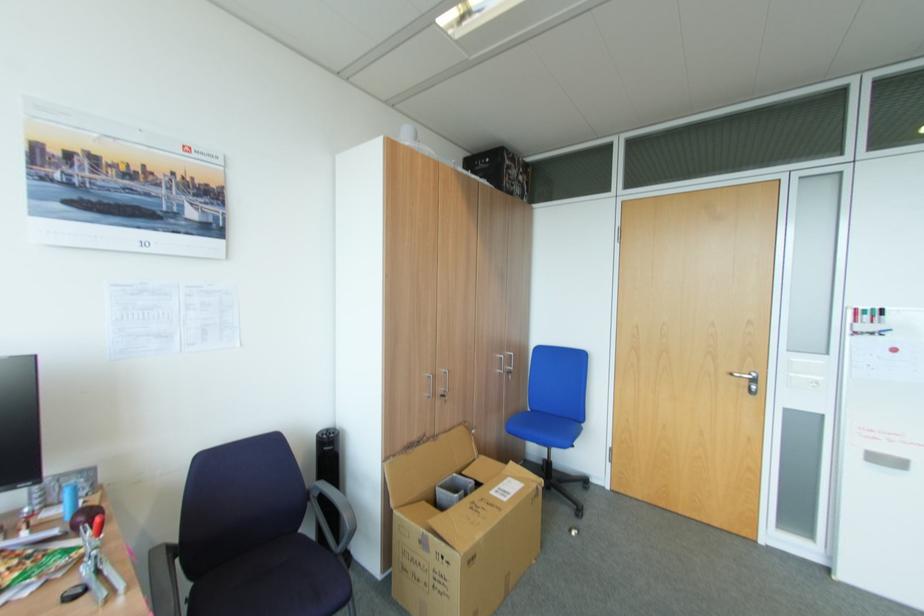
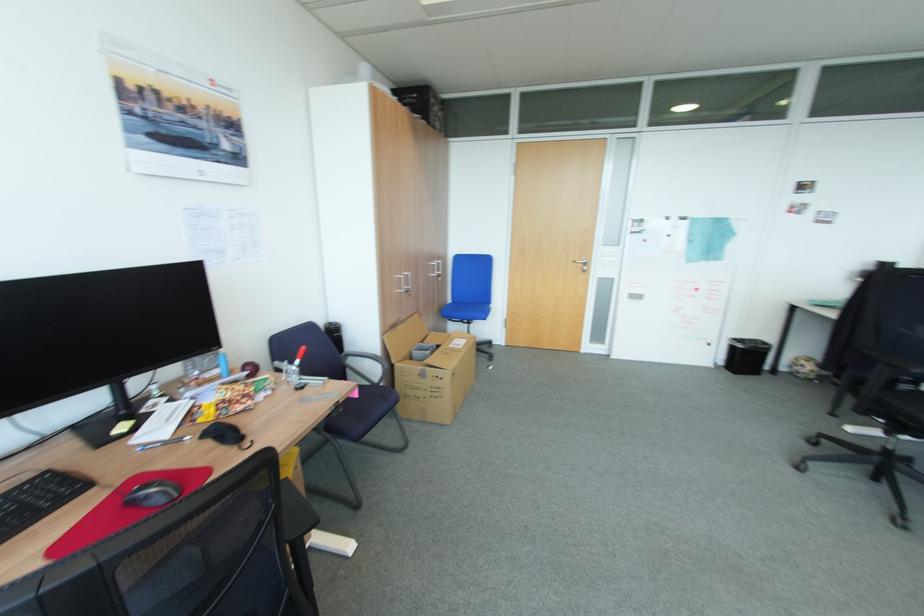
In a continuous first-person perspective shot, in which direction is the camera moving?

The cameraman walked toward left, backward.